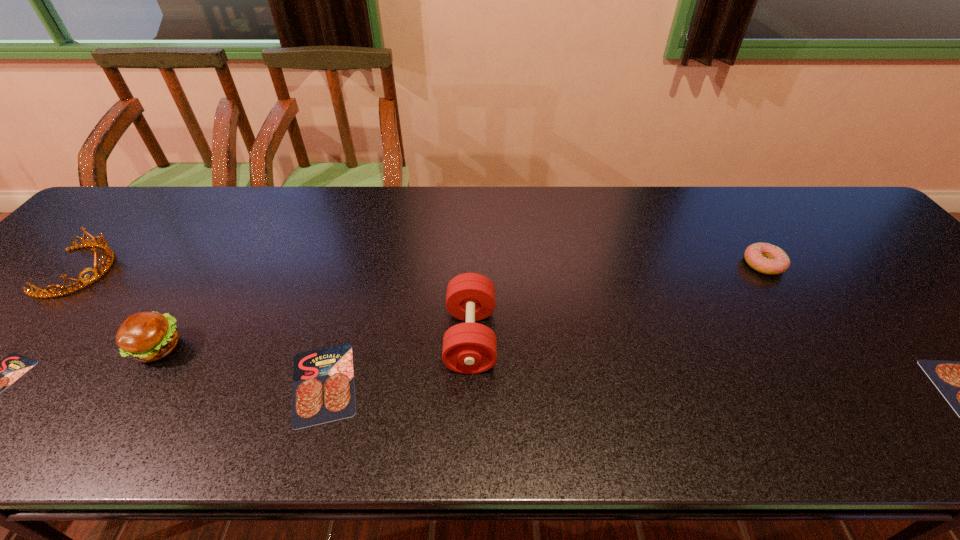
Image resolution: width=960 pixels, height=540 pixels. In the image, there is a desktop. Find the location of `free space at the far left corner`. free space at the far left corner is located at coordinates (160, 196).

The width and height of the screenshot is (960, 540). Find the location of `blank area at the far right corner`. blank area at the far right corner is located at coordinates (857, 227).

Image resolution: width=960 pixels, height=540 pixels. I want to click on vacant point located between the sixth tallest object and the third object from left to right, so click(x=241, y=366).

Find the location of a particular element. The height and width of the screenshot is (540, 960). vacant space in between the second shortest object and the fourth shortest object is located at coordinates (543, 324).

Find the location of `empty location between the second shortest object and the doughnut`. empty location between the second shortest object and the doughnut is located at coordinates coord(543,324).

Where is `vacant space in between the hamburger and the tiara`? The image size is (960, 540). vacant space in between the hamburger and the tiara is located at coordinates (119, 309).

This screenshot has width=960, height=540. Identify the location of object that is the fifth closest to the tallest object. (109, 255).

Choose which object is the second nearest neighbor to the fourth object from left to right. Please provide its 2D coordinates. Your answer should be formatted as a tuple, i.e. [(x, y)], where the tuple contains the x and y coordinates of a point satisfying the conditions above.

[(145, 336)]

Choose which salami is the second nearest neighbor to the fourth object from right to left. Please provide its 2D coordinates. Your answer should be formatted as a tuple, i.e. [(x, y)], where the tuple contains the x and y coordinates of a point satisfying the conditions above.

[(959, 382)]

You are a GUI agent. You are given a task and a screenshot of the screen. Output one action in this format:
    pyautogui.click(x=<x>, y=<y>)
    Task: Click on the salami that can be found as the second closest to the second shortest salami
    
    Given the screenshot: What is the action you would take?
    pyautogui.click(x=959, y=382)